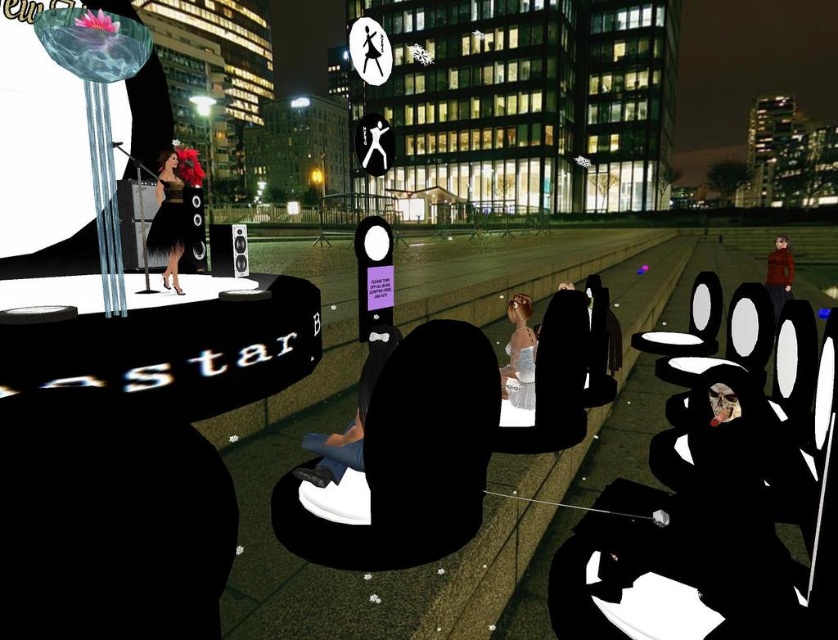
Is black satin dress at center wider than silky white dress at center?

Indeed, black satin dress at center has a greater width compared to silky white dress at center.

Where is `black satin dress at center`? black satin dress at center is located at coordinates (169, 220).

Does point (174, 202) come closer to viewer compared to point (505, 396)?

No.

Where is `black satin dress at center`? Image resolution: width=838 pixels, height=640 pixels. black satin dress at center is located at coordinates (169, 220).

Which is above, silky white dress at center or red wool sweater at right?

red wool sweater at right is above.

Is silky white dress at center bigger than red wool sweater at right?

Actually, silky white dress at center might be smaller than red wool sweater at right.

Find the location of a particular element. The height and width of the screenshot is (640, 838). silky white dress at center is located at coordinates (520, 355).

This screenshot has width=838, height=640. I want to click on silky white dress at center, so [x=520, y=355].

Can you confirm if black satin dress at center is wider than red wool sweater at right?

No, black satin dress at center is not wider than red wool sweater at right.

Does point (174, 275) lie behind point (789, 259)?

No, (174, 275) is closer to viewer.

Where is `black satin dress at center`? This screenshot has width=838, height=640. black satin dress at center is located at coordinates (169, 220).